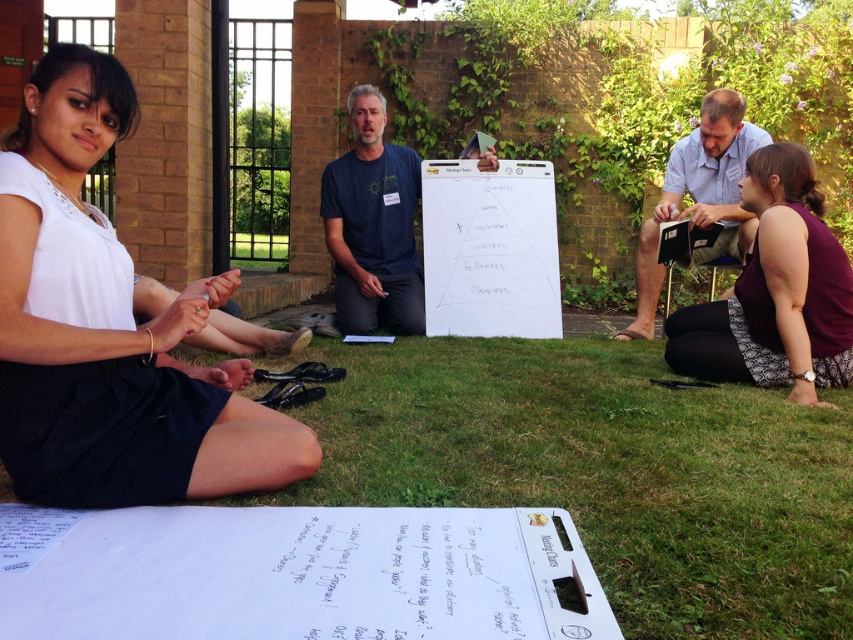
Between white fabric skirt at lower left and purple fabric shirt at lower right, which one has less height?

purple fabric shirt at lower right is shorter.

Is white fabric skirt at lower left smaller than purple fabric shirt at lower right?

Yes.

Is point (57, 74) positioned in front of point (831, 358)?

Yes, point (57, 74) is closer to viewer.

This screenshot has height=640, width=853. Find the location of `white fabric skirt at lower left`. white fabric skirt at lower left is located at coordinates (108, 330).

In the scene shown: Who is shorter, white fabric skirt at lower left or blue denim shirt at upper right?

With less height is white fabric skirt at lower left.

Which is above, white fabric skirt at lower left or blue denim shirt at upper right?

blue denim shirt at upper right

The image size is (853, 640). Find the location of `white fabric skirt at lower left`. white fabric skirt at lower left is located at coordinates (108, 330).

Does dark blue t-shirt at center appear under blue denim shirt at upper right?

No, dark blue t-shirt at center is not below blue denim shirt at upper right.

Is dark blue t-shirt at center positioned before blue denim shirt at upper right?

No, it is not.

Locate an element on the screen. This screenshot has width=853, height=640. dark blue t-shirt at center is located at coordinates (373, 225).